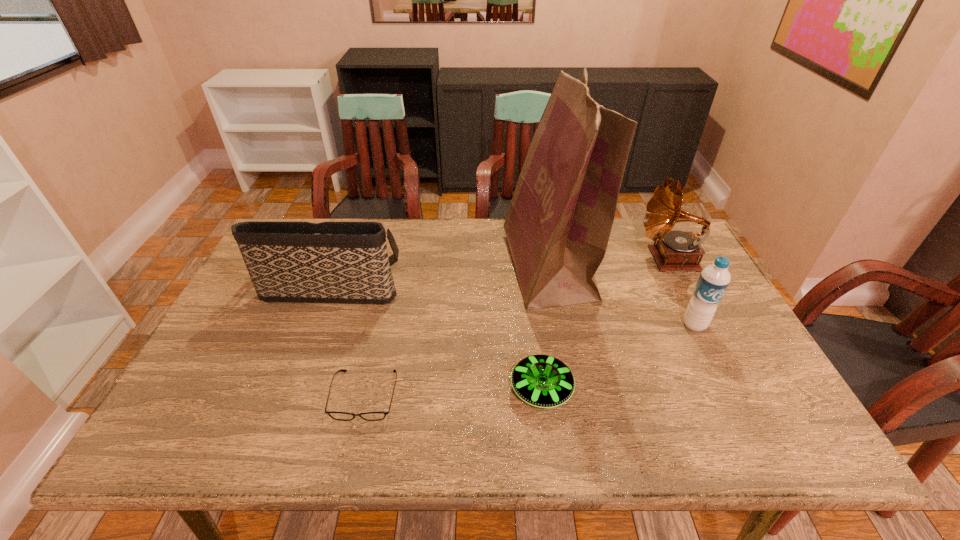
This screenshot has height=540, width=960. What are the coordinates of `vacant point located on the horn of the phonograph_record` in the screenshot? It's located at (591, 259).

Find the location of a particular element. Image resolution: width=960 pixels, height=540 pixels. free space located 0.360m on the horn of the phonograph_record is located at coordinates (524, 259).

What are the coordinates of `free space located on the front of the handbag` in the screenshot? It's located at (317, 321).

Locate an element on the screen. This screenshot has height=540, width=960. free space located 0.160m on the label of the water bottle is located at coordinates (725, 386).

This screenshot has width=960, height=540. What are the coordinates of `free space located 0.080m on the right of the fifth tallest object` in the screenshot? It's located at (608, 389).

This screenshot has width=960, height=540. In order to click on grocery bag at the far edge in this screenshot , I will do `click(558, 225)`.

Find the location of a particular element. Image resolution: width=960 pixels, height=540 pixels. phonograph_record situated at the far edge is located at coordinates (675, 250).

Image resolution: width=960 pixels, height=540 pixels. I want to click on saucer that is positioned at the near edge, so click(x=544, y=381).

This screenshot has width=960, height=540. I want to click on spectacles located in the near edge section of the desktop, so click(x=343, y=416).

Identify the location of object at the left edge. Image resolution: width=960 pixels, height=540 pixels. (329, 262).